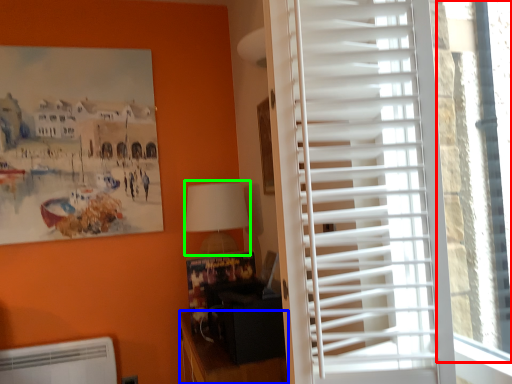
Question: Considering the real-world distances, which object is closest to window screen (highlighted by a red box)? furniture (highlighted by a blue box) or table lamp (highlighted by a green box).

Choices:
 (A) furniture
 (B) table lamp

Answer: (A)